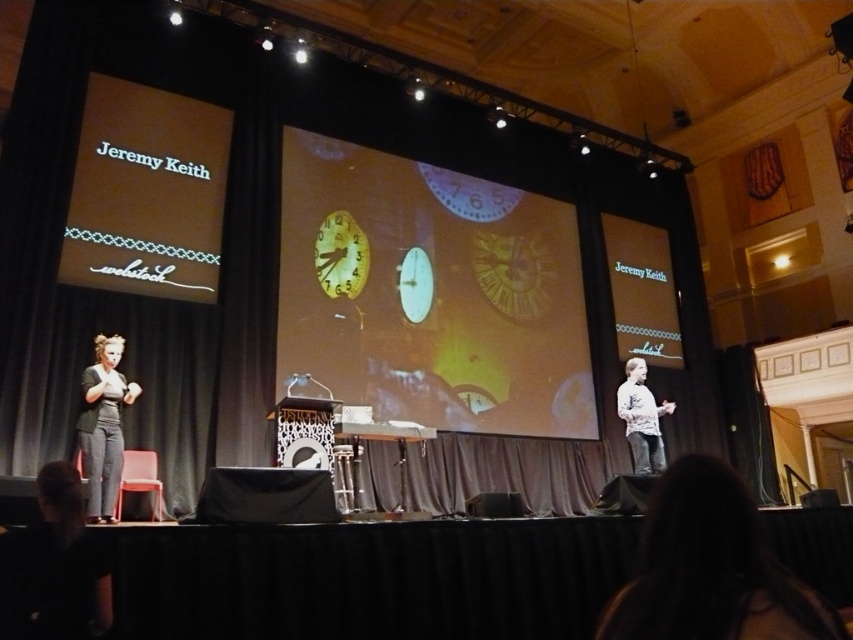
Based on the scene description, where is the translucent glass clock at center located in terms of its 2D coordinates?

The translucent glass clock at center is located at the 2D coordinates point (x=430, y=292).